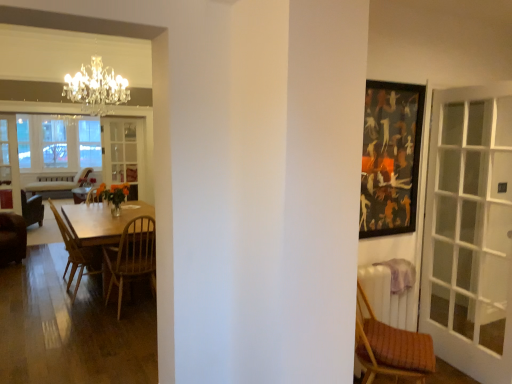
At what (x,y) coordinates should I click in order to perform the action: click on free spot in front of wooden at left, which appears as the 2th chair when viewed from the right. Please return your answer as a coordinate pair (x, y). The height and width of the screenshot is (384, 512). Looking at the image, I should click on (106, 336).